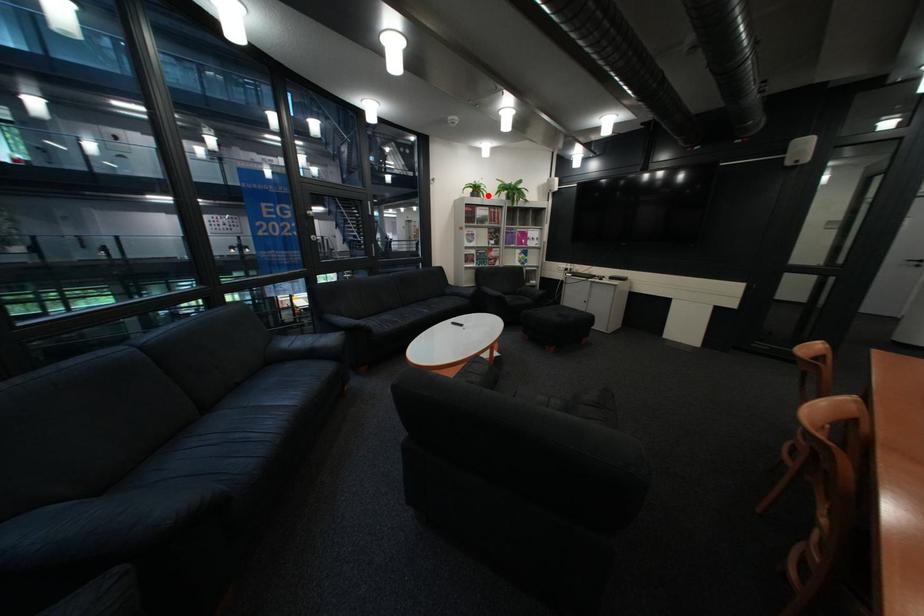
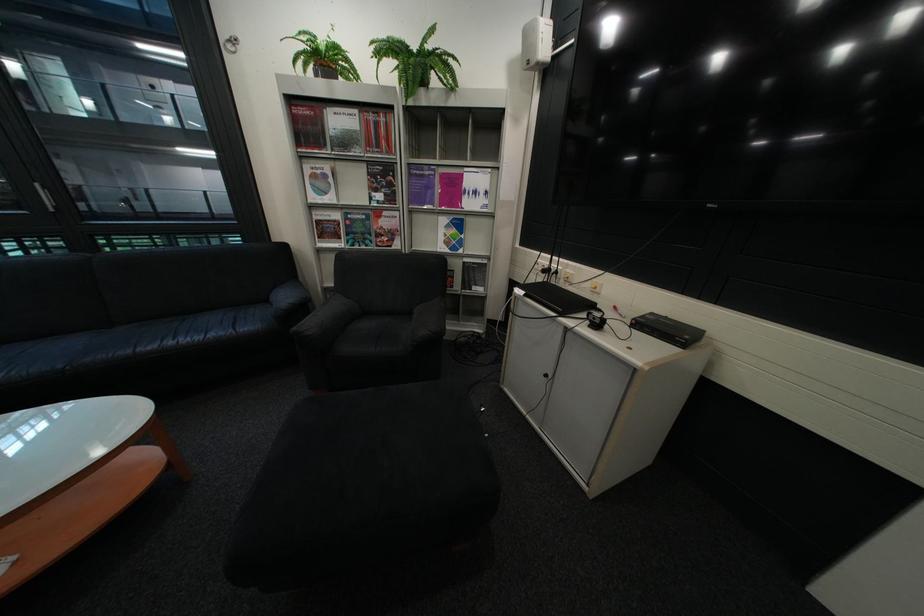
Question: I am providing you with two images of the same scene from different viewpoints. In image1, a red point is highlighted. Considering the same 3D point in image2, which of the following is correct?

Choices:
 (A) It is closer
 (B) It is farther

Answer: (B)